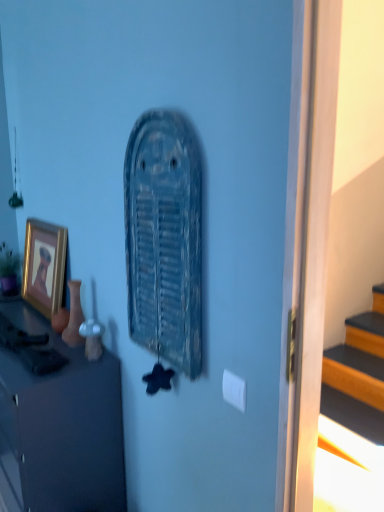
This screenshot has height=512, width=384. Describe the element at coordinates (9, 271) in the screenshot. I see `green matte houseplant at left` at that location.

The image size is (384, 512). I want to click on matte black cabinet at left, so click(x=61, y=428).

The image size is (384, 512). Describe the element at coordinates (164, 239) in the screenshot. I see `rusty metal vent at center` at that location.

Where is `gold-framed picture at left`? The width and height of the screenshot is (384, 512). gold-framed picture at left is located at coordinates (44, 266).

Considering the relative positions of green matte houseplant at left and rusty metal vent at center in the image provided, is green matte houseplant at left in front of rusty metal vent at center?

No.

Measure the distance from green matte houseplant at left to rusty metal vent at center.

A distance of 1.50 meters exists between green matte houseplant at left and rusty metal vent at center.

Which point is more distant from viewer, (10, 287) or (196, 285)?

Point (10, 287)

From a real-world perspective, is green matte houseplant at left below rusty metal vent at center?

Yes.

Could you tell me if matte black cabinet at left is facing gold-framed picture at left?

No, matte black cabinet at left does not turn towards gold-framed picture at left.

Where is `cabinetry on the left of gold-framed picture at left`? cabinetry on the left of gold-framed picture at left is located at coordinates (61, 428).

Does point (22, 473) come farther from viewer compared to point (30, 224)?

No, (22, 473) is closer to viewer.

Between matte black cabinet at left and gold-framed picture at left, which one is positioned in front?

Positioned in front is matte black cabinet at left.

Does rusty metal vent at center have a larger size compared to green matte houseplant at left?

Correct, rusty metal vent at center is larger in size than green matte houseplant at left.

Is rusty metal vent at center turned away from green matte houseplant at left?

No, green matte houseplant at left is not at the back of rusty metal vent at center.

From the image's perspective, is rusty metal vent at center beneath green matte houseplant at left?

No.

From a real-world perspective, does rusty metal vent at center stand above green matte houseplant at left?

Indeed, from a real-world perspective, rusty metal vent at center stands above green matte houseplant at left.

Does matte black cabinet at left lie in front of green matte houseplant at left?

Yes.

Can you see matte black cabinet at left touching green matte houseplant at left?

No, matte black cabinet at left is not in contact with green matte houseplant at left.

Locate an element on the screen. This screenshot has width=384, height=512. cabinetry in front of the green matte houseplant at left is located at coordinates (61, 428).

From a real-world perspective, which is physically above, gold-framed picture at left or matte black cabinet at left?

From a 3D spatial view, gold-framed picture at left is above.

Does gold-framed picture at left appear on the right side of matte black cabinet at left?

Yes.

Between gold-framed picture at left and matte black cabinet at left, which one is positioned behind?

gold-framed picture at left is further away from the camera.

Can you confirm if matte black cabinet at left is wider than rusty metal vent at center?

Correct, the width of matte black cabinet at left exceeds that of rusty metal vent at center.

How distant is matte black cabinet at left from rusty metal vent at center?

matte black cabinet at left is 23.59 inches from rusty metal vent at center.

From the image's perspective, is matte black cabinet at left above or below rusty metal vent at center?

matte black cabinet at left is situated lower than rusty metal vent at center in the image.

Which of these two, matte black cabinet at left or rusty metal vent at center, stands shorter?

With less height is matte black cabinet at left.

Consider the image. Between green matte houseplant at left and matte black cabinet at left, which one has larger width?

matte black cabinet at left is wider.

Would you say green matte houseplant at left is inside or outside matte black cabinet at left?

green matte houseplant at left exists outside the volume of matte black cabinet at left.

Who is bigger, green matte houseplant at left or matte black cabinet at left?

matte black cabinet at left.

This screenshot has height=512, width=384. Find the location of `houseplant that appears behind the rusty metal vent at center`. houseplant that appears behind the rusty metal vent at center is located at coordinates (9, 271).

Locate an element on the screen. This screenshot has height=512, width=384. picture frame above the matte black cabinet at left (from the image's perspective) is located at coordinates (44, 266).

Which object lies nearer to the anchor point rusty metal vent at center, gold-framed picture at left or green matte houseplant at left?

gold-framed picture at left.

Looking at this image, considering their positions, is green matte houseplant at left positioned closer to gold-framed picture at left than rusty metal vent at center?

green matte houseplant at left is positioned closer to the anchor gold-framed picture at left.

Consider the image. Which object lies nearer to the anchor point green matte houseplant at left, rusty metal vent at center or matte black cabinet at left?

Based on the image, matte black cabinet at left appears to be nearer to green matte houseplant at left.

Looking at the image, which one is located closer to matte black cabinet at left, gold-framed picture at left or rusty metal vent at center?

rusty metal vent at center is closer to matte black cabinet at left.

Estimate the real-world distances between objects in this image. Which object is further from rusty metal vent at center, gold-framed picture at left or matte black cabinet at left?

gold-framed picture at left is further to rusty metal vent at center.

Based on their spatial positions, is green matte houseplant at left or gold-framed picture at left further from rusty metal vent at center?

Among the two, green matte houseplant at left is located further to rusty metal vent at center.

Considering their positions, is green matte houseplant at left positioned further to rusty metal vent at center than matte black cabinet at left?

Among the two, green matte houseplant at left is located further to rusty metal vent at center.

Estimate the real-world distances between objects in this image. Which object is further from green matte houseplant at left, matte black cabinet at left or rusty metal vent at center?

rusty metal vent at center lies further to green matte houseplant at left than the other object.

Where is `picture frame between rusty metal vent at center and green matte houseplant at left along the z-axis`? The width and height of the screenshot is (384, 512). picture frame between rusty metal vent at center and green matte houseplant at left along the z-axis is located at coordinates (44, 266).

The height and width of the screenshot is (512, 384). Find the location of `cabinetry between rusty metal vent at center and green matte houseplant at left from front to back`. cabinetry between rusty metal vent at center and green matte houseplant at left from front to back is located at coordinates (61, 428).

This screenshot has height=512, width=384. Find the location of `picture frame between matte black cabinet at left and green matte houseplant at left along the z-axis`. picture frame between matte black cabinet at left and green matte houseplant at left along the z-axis is located at coordinates 44,266.

Where is `cabinetry positioned between rusty metal vent at center and gold-framed picture at left from near to far`? cabinetry positioned between rusty metal vent at center and gold-framed picture at left from near to far is located at coordinates (61, 428).